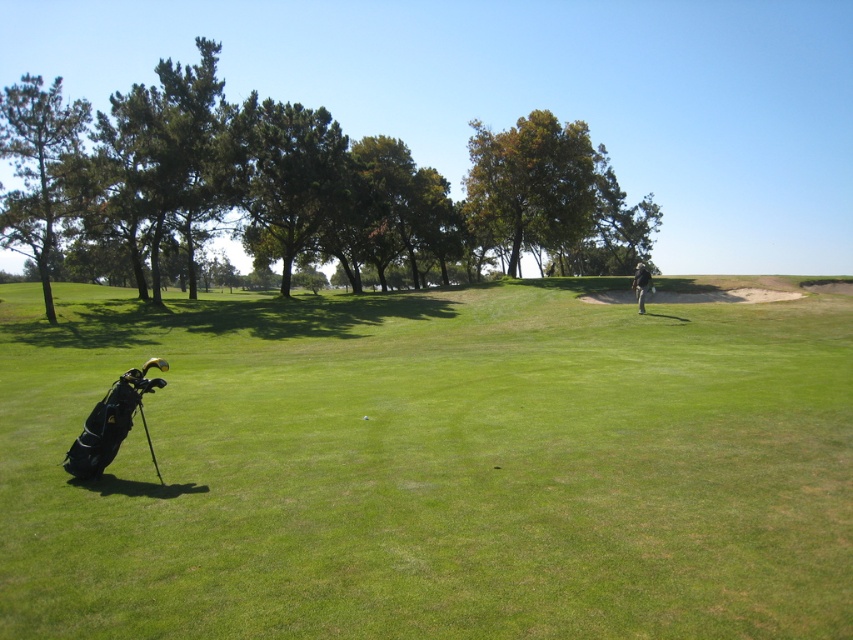
Is green matte tree at left to the left of light brown leather jacket at center from the viewer's perspective?

Indeed, green matte tree at left is positioned on the left side of light brown leather jacket at center.

Does green matte tree at left lie behind light brown leather jacket at center?

Yes, green matte tree at left is behind light brown leather jacket at center.

Does point (44, 292) lie behind point (643, 282)?

Yes, it is behind point (643, 282).

This screenshot has width=853, height=640. Find the location of `green matte tree at left`. green matte tree at left is located at coordinates (38, 168).

Can you confirm if green leafy tree at left is positioned above light brown leather jacket at center?

Yes.

Between point (345, 266) and point (643, 266), which one is positioned in front?

Point (643, 266) is in front.

Identify the location of green leafy tree at left. This screenshot has height=640, width=853. (302, 188).

Who is positioned more to the right, black leather golf bag at lower left or white matte golf ball at center?

white matte golf ball at center is more to the right.

Find the location of a particular element. black leather golf bag at lower left is located at coordinates (430, 467).